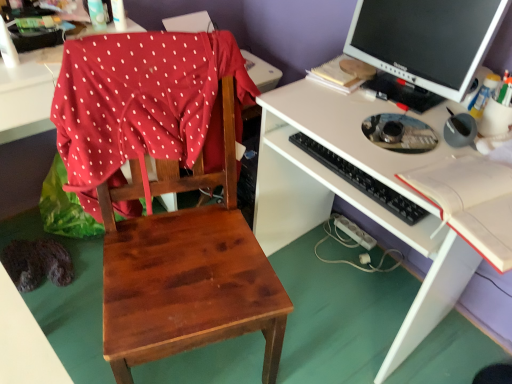
Image resolution: width=512 pixels, height=384 pixels. I want to click on free point below white matte desk at center (from a real-world perspective), so click(360, 314).